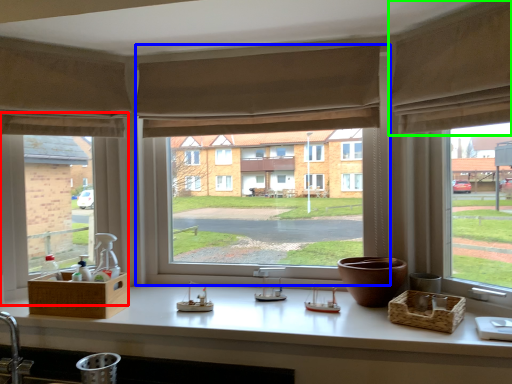
Question: Which object is positioned closest to window (highlighted by a red box)? Select from window (highlighted by a blue box) and curtain (highlighted by a green box).

Choices:
 (A) window
 (B) curtain

Answer: (A)